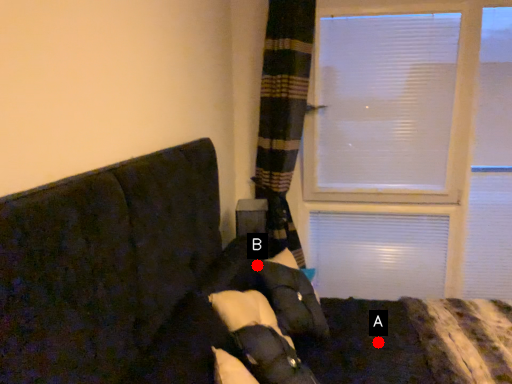
Question: Two points are circled on the image, labeled by A and B beside each circle. Which of the following is the closest to the observer?

Choices:
 (A) A is closer
 (B) B is closer

Answer: (A)